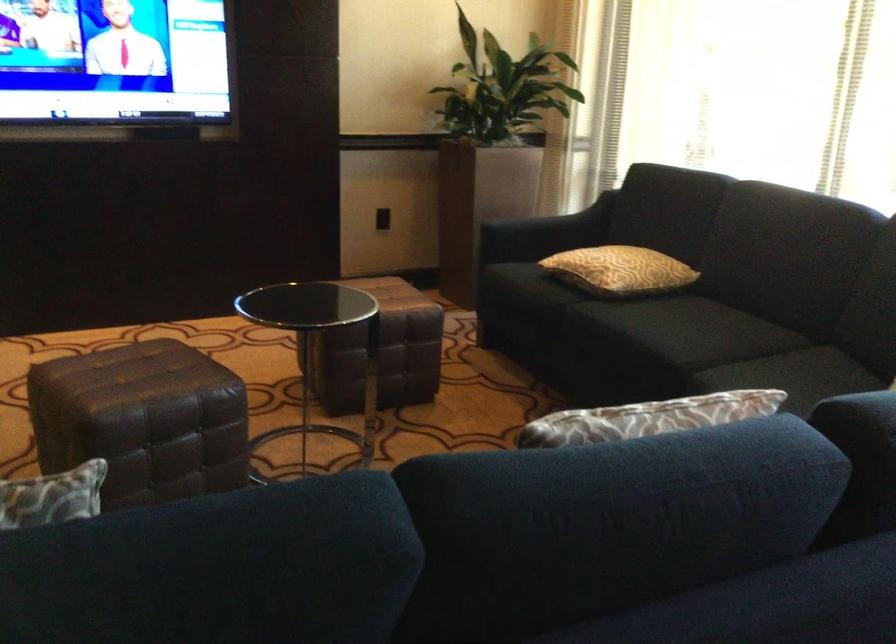
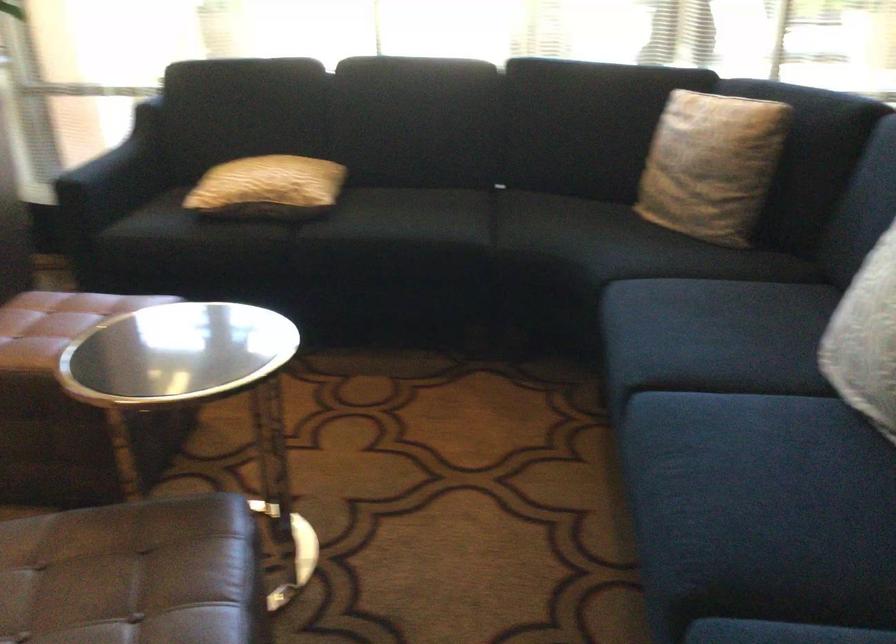
Find the pixel in the second image that matches the point at 583,263 in the first image.

(268, 187)